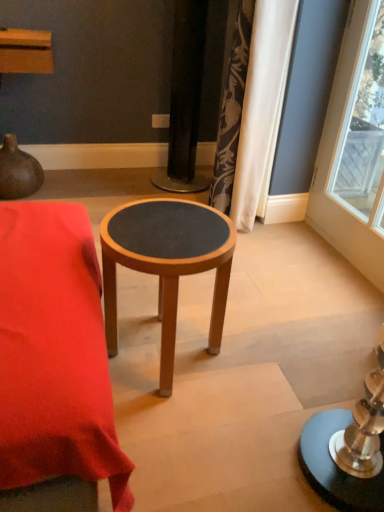
The width and height of the screenshot is (384, 512). Find the location of `free space in front of wooden stool at center`. free space in front of wooden stool at center is located at coordinates (190, 445).